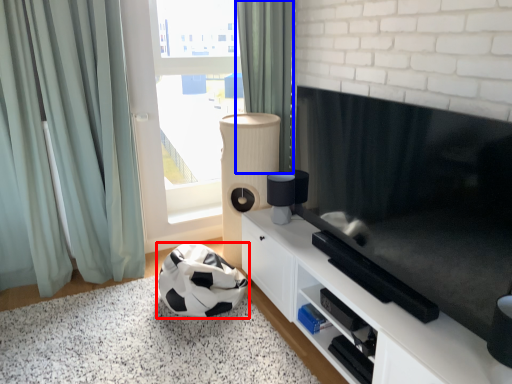
Question: Among these objects, which one is nearest to the camera, football (highlighted by a red box) or curtain (highlighted by a blue box)?

Choices:
 (A) football
 (B) curtain

Answer: (A)